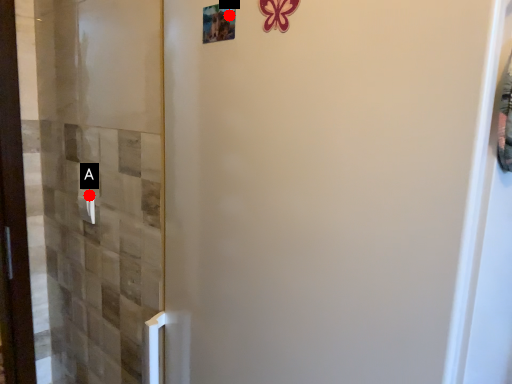
Question: Two points are circled on the image, labeled by A and B beside each circle. Which point appears closest to the camera in this image?

Choices:
 (A) A is closer
 (B) B is closer

Answer: (B)